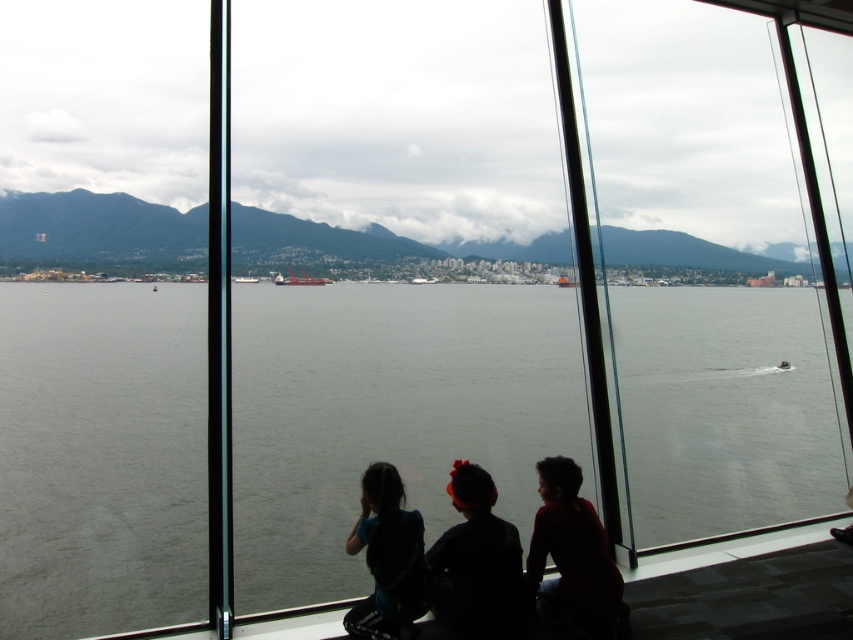
Question: Is silhouette fabric child at lower center below metallic gray cargo ship at center?

Choices:
 (A) no
 (B) yes

Answer: (B)

Question: Which object appears farthest from the camera in this image?

Choices:
 (A) silhouette fabric child at center
 (B) silhouette fabric child at lower center

Answer: (A)

Question: Does gray water at center come behind silhouette of child at right?

Choices:
 (A) no
 (B) yes

Answer: (B)

Question: Estimate the real-world distances between objects in this image. Which object is closer to the white plastic boat at center?

Choices:
 (A) silhouette of child at right
 (B) silhouette fabric child at center
 (C) metallic gray cargo ship at center
 (D) gray water at center

Answer: (C)

Question: Which object is the farthest from the white plastic boat at center?

Choices:
 (A) gray water at center
 (B) metallic gray cargo ship at center

Answer: (A)

Question: Where is silhouette of child at right located in relation to silhouette fabric child at lower center in the image?

Choices:
 (A) left
 (B) right

Answer: (B)